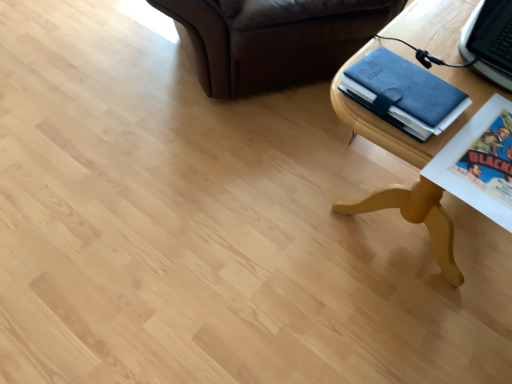
Identify the location of vacant area on top of blue leather binder at upper right (from a real-world perspective). point(404,83).